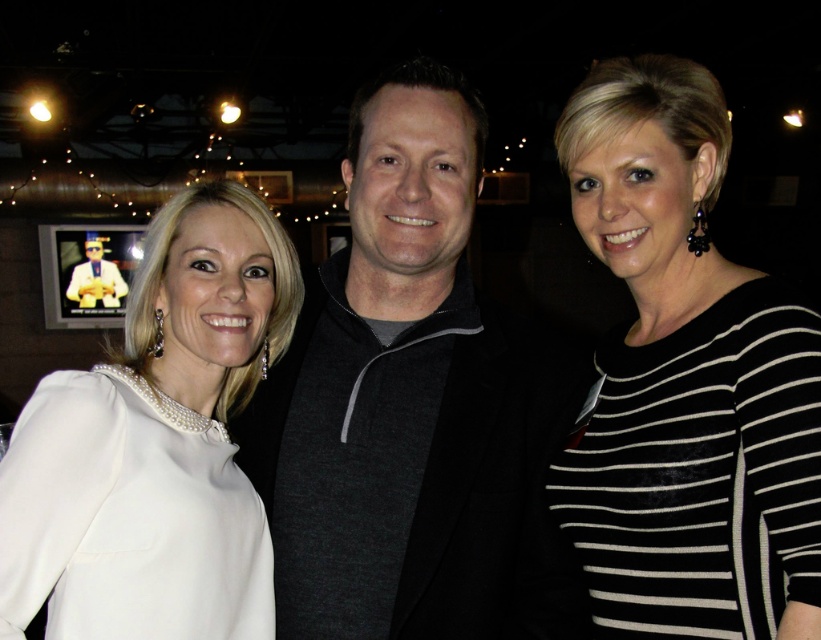
You are at a party and see two people wearing the black striped shirt at center and the white satin dress at center. If you want to hand a drink to both without moving, which one should you aim higher?

The black striped shirt at center is taller than the white satin dress at center, so you should aim higher for the black striped shirt at center.

You are a photographer at a social event and need to adjust the lighting to ensure both the dark gray sweater at center and the white satin dress at center are visible. Since the sweater is taller than the dress, which clothing item might cast a shadow on the other? Please explain your reasoning.

The dark gray sweater at center is taller than the white satin dress at center, so the dark gray sweater at center might cast a shadow on the white satin dress at center because it is positioned higher and could block the light reaching the lower clothing item.